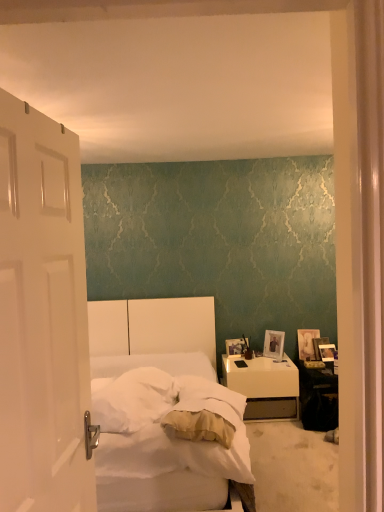
Question: Is wooden photo frame at right, the 3th picture frame positioned from the right, to the left of white soft bedsheet at center from the viewer's perspective?

Choices:
 (A) yes
 (B) no

Answer: (B)

Question: Does wooden photo frame at right, the 3th picture frame positioned from the right, have a greater width compared to white soft bedsheet at center?

Choices:
 (A) no
 (B) yes

Answer: (A)

Question: Does wooden photo frame at right, which is the third picture frame in left-to-right order, appear on the right side of white soft bedsheet at center?

Choices:
 (A) yes
 (B) no

Answer: (A)

Question: Considering the relative sizes of wooden photo frame at right, which is the third picture frame in left-to-right order, and white soft bedsheet at center in the image provided, is wooden photo frame at right, which is the third picture frame in left-to-right order, smaller than white soft bedsheet at center?

Choices:
 (A) yes
 (B) no

Answer: (A)

Question: Is wooden photo frame at right, which is the third picture frame in left-to-right order, located outside white soft bedsheet at center?

Choices:
 (A) no
 (B) yes

Answer: (B)

Question: In terms of height, does wooden photo frame at right, the 5th picture frame positioned from the right, look taller or shorter compared to wooden photo frame at right, which is the 2th picture frame from right to left?

Choices:
 (A) short
 (B) tall

Answer: (A)

Question: Would you say wooden photo frame at right, which ranks as the 1th picture frame in left-to-right order, is to the left or to the right of wooden photo frame at right, the fourth picture frame in the left-to-right sequence, in the picture?

Choices:
 (A) left
 (B) right

Answer: (A)

Question: Would you say wooden photo frame at right, which ranks as the 1th picture frame in left-to-right order, is inside or outside wooden photo frame at right, the fourth picture frame in the left-to-right sequence?

Choices:
 (A) inside
 (B) outside

Answer: (B)

Question: Looking at the image, does wooden photo frame at right, the 5th picture frame positioned from the right, seem bigger or smaller compared to wooden photo frame at right, the fourth picture frame in the left-to-right sequence?

Choices:
 (A) small
 (B) big

Answer: (B)

Question: Is black glossy table at lower right in front of or behind white glossy nightstand at lower right in the image?

Choices:
 (A) front
 (B) behind

Answer: (A)

Question: Based on their positions, is black glossy table at lower right located to the left or right of white glossy nightstand at lower right?

Choices:
 (A) left
 (B) right

Answer: (B)

Question: From a real-world perspective, is black glossy table at lower right positioned above or below white glossy nightstand at lower right?

Choices:
 (A) below
 (B) above

Answer: (A)

Question: In terms of height, does black glossy table at lower right look taller or shorter compared to white glossy nightstand at lower right?

Choices:
 (A) tall
 (B) short

Answer: (B)

Question: Considering the positions of point (319, 398) and point (241, 351), is point (319, 398) closer or farther from the camera than point (241, 351)?

Choices:
 (A) closer
 (B) farther

Answer: (A)

Question: From a real-world perspective, relative to wooden photo frame at right, which ranks as the 1th picture frame in left-to-right order, is black glossy table at lower right vertically above or below?

Choices:
 (A) above
 (B) below

Answer: (B)